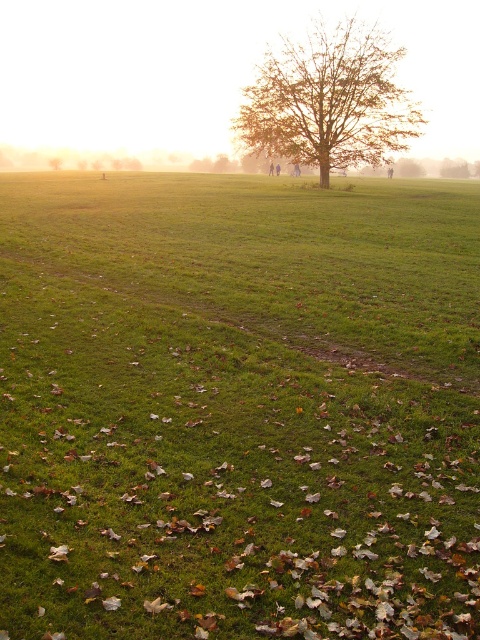
Is green grassy field at center positioned in front of brown textured tree at center?

Yes, it is in front of brown textured tree at center.

Who is more distant from viewer, (36, 280) or (319, 58)?

Positioned behind is point (319, 58).

Find the location of a particular element. This screenshot has height=640, width=480. green grassy field at center is located at coordinates (239, 406).